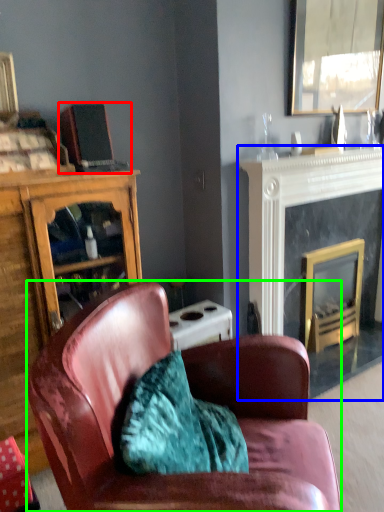
Question: Considering the real-world distances, which object is closest to laptop (highlighted by a red box)? fireplace (highlighted by a blue box) or chair (highlighted by a green box).

Choices:
 (A) fireplace
 (B) chair

Answer: (B)